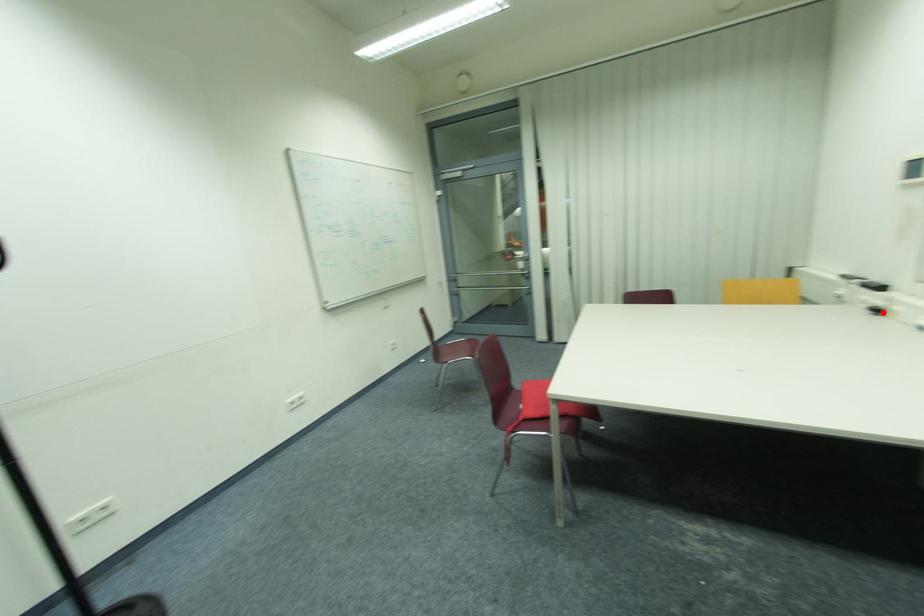
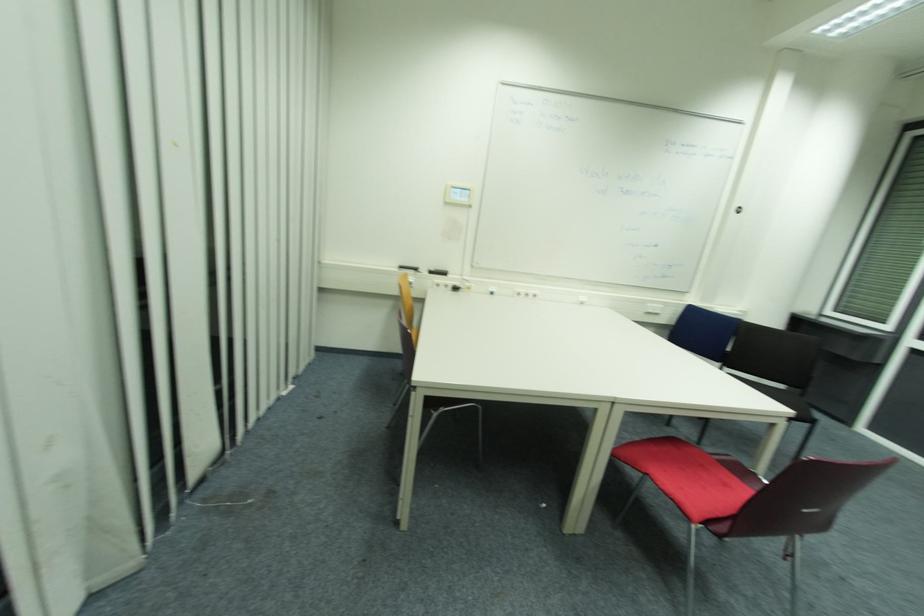
Question: I am providing you with two images of the same scene from different viewpoints. Image1 has a red point marked. In image2, the corresponding 3D location appears at what relative position? Reply with the corresponding letter.

Choices:
 (A) Closer
 (B) Farther

Answer: (A)